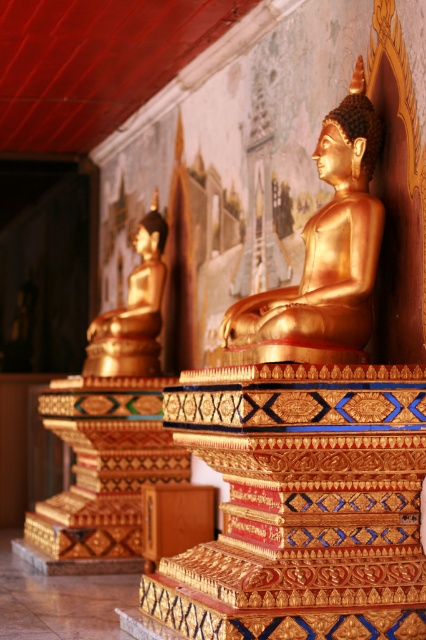
You are an architect designing a new temple and want to place the gold shiny statue at center and the gold polished statue at left in the main hall. Based on their sizes, which statue should be placed closer to the entrance for better visibility?

The gold shiny statue at center is much taller than the gold polished statue at left, so it should be placed closer to the entrance to ensure it is easily visible to visitors.

You are a tour guide leading a group through a temple. You want to ensure visitors can comfortably walk between the gold shiny statue at center and the gold polished statue at left. The path between them is 3.02 meters wide. If a visitor is using a wheelchair that requires a 1.5 meter wide path, will they be able to navigate between the two statues comfortably?

The path between the gold shiny statue at center and the gold polished statue at left is 3.02 meters wide, which is wider than the required 1.5 meters for the wheelchair. Therefore, the visitor will be able to navigate comfortably between the two statues.

You are an art student observing the temple scene. You notice two Buddha statues. The gold shiny statue at center and the gold polished statue at left. Which one is positioned higher in the image?

The gold shiny statue at center is positioned higher than the gold polished statue at left.